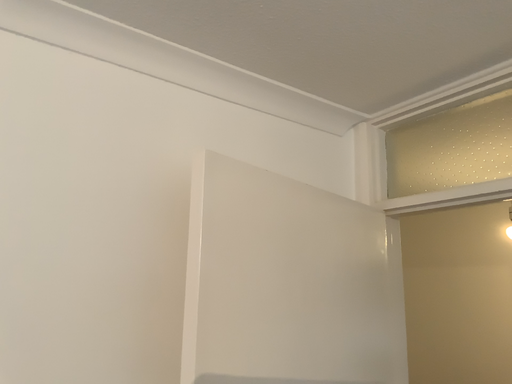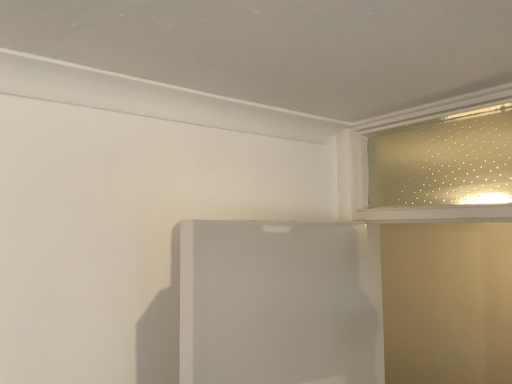
Question: Which way did the camera rotate in the video?

Choices:
 (A) rotated upward
 (B) rotated downward

Answer: (B)